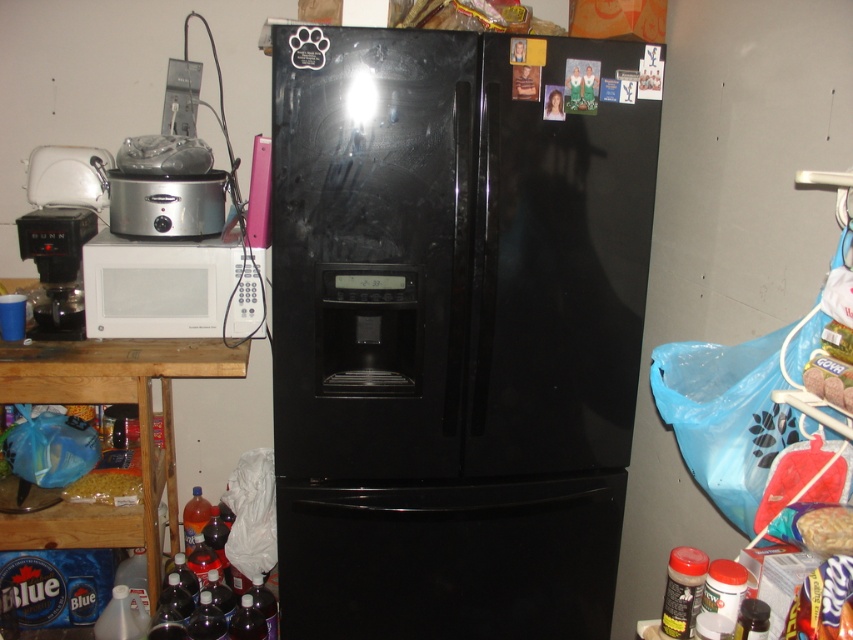
Can you confirm if black plastic coffee maker at left is shorter than smooth plastic bag at lower right?

No, black plastic coffee maker at left is not shorter than smooth plastic bag at lower right.

Who is more distant from viewer, (80, 304) or (845, 547)?

The point (80, 304) is more distant.

Based on the photo, who is more distant from viewer, (x=41, y=326) or (x=828, y=540)?

The point (x=41, y=326) is behind.

Image resolution: width=853 pixels, height=640 pixels. I want to click on black plastic coffee maker at left, so click(x=57, y=266).

Can you confirm if smooth plastic bag at lower right is taller than matte yellow pasta at lower left?

No, smooth plastic bag at lower right is not taller than matte yellow pasta at lower left.

Locate an element on the screen. This screenshot has width=853, height=640. smooth plastic bag at lower right is located at coordinates (827, 531).

Identify the location of smooth plastic bag at lower right. The width and height of the screenshot is (853, 640). (827, 531).

Does black glossy refrigerator at center have a larger size compared to black plastic coffee maker at left?

Yes, black glossy refrigerator at center is bigger than black plastic coffee maker at left.

Which is above, black glossy refrigerator at center or black plastic coffee maker at left?

black plastic coffee maker at left is higher up.

Does point (379, 384) come farther from viewer compared to point (68, 260)?

No, it is not.

Identify the location of black glossy refrigerator at center. This screenshot has height=640, width=853. (450, 340).